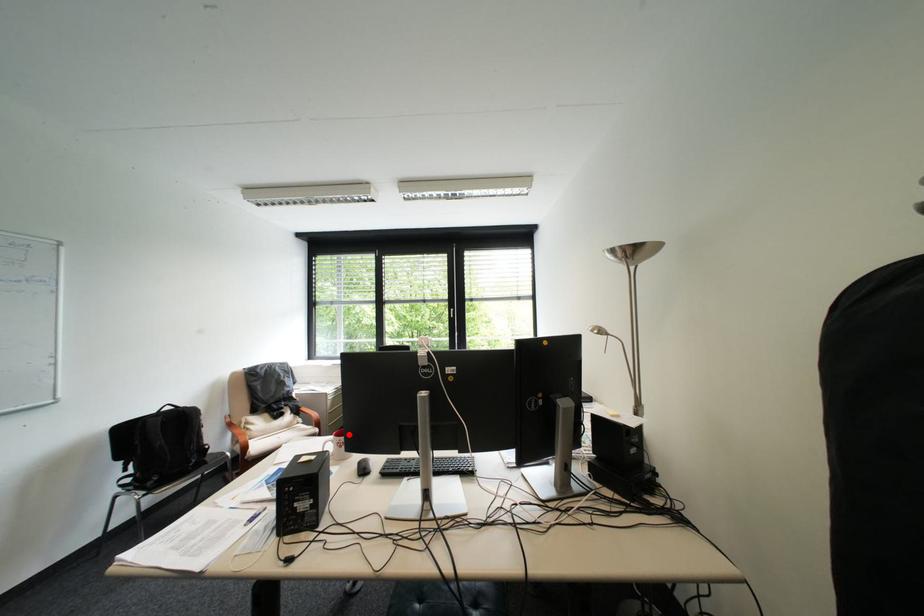
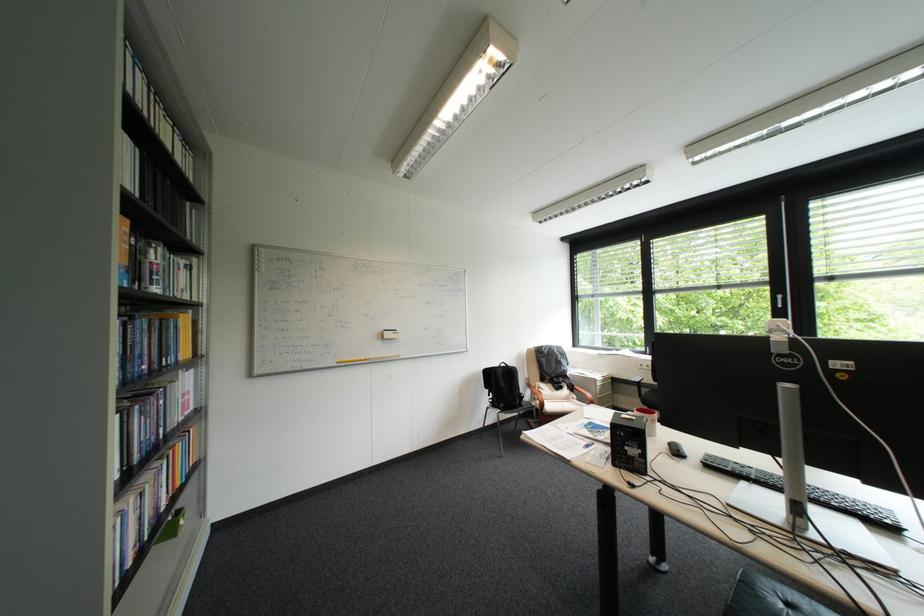
Question: I am providing you with two images of the same scene from different viewpoints. Given a red point in image1, look at the same physical point in image2. Is it:

Choices:
 (A) Closer to the viewpoint
 (B) Farther from the viewpoint

Answer: (A)